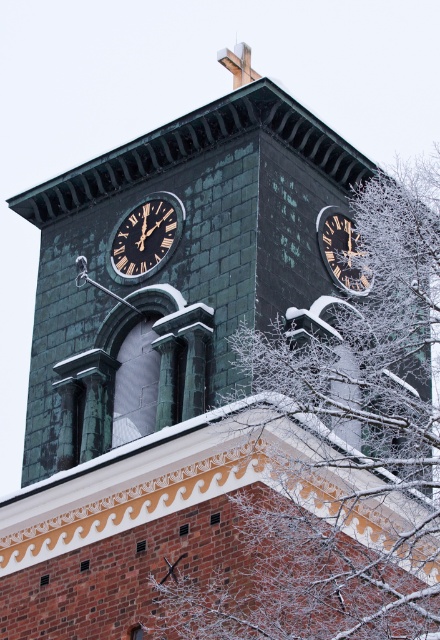
Which of these two, dark brown wooden clock at center or gold-toned metal clock at upper right, stands shorter?

Standing shorter between the two is gold-toned metal clock at upper right.

Does point (171, 218) come behind point (349, 252)?

That is False.

Identify the location of dark brown wooden clock at center. (145, 237).